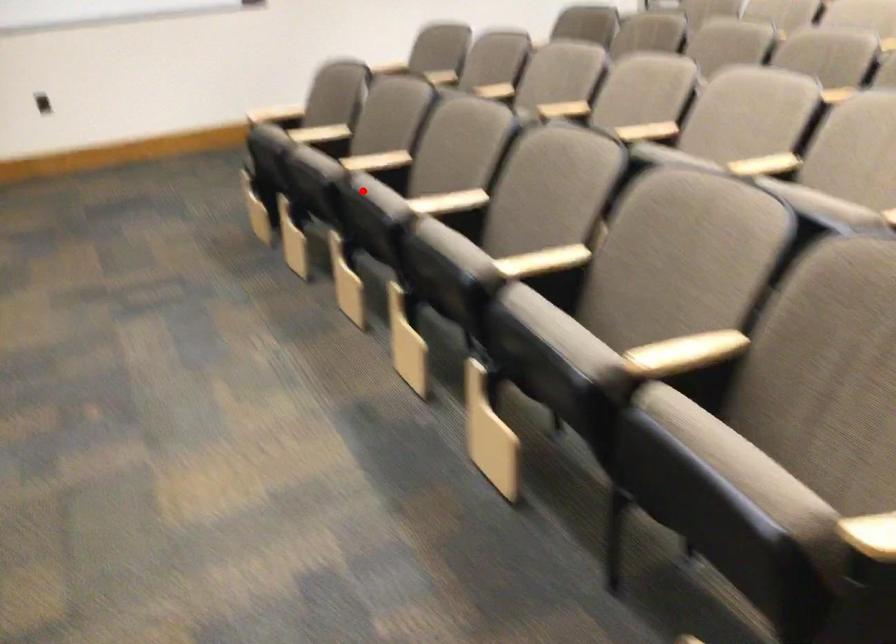
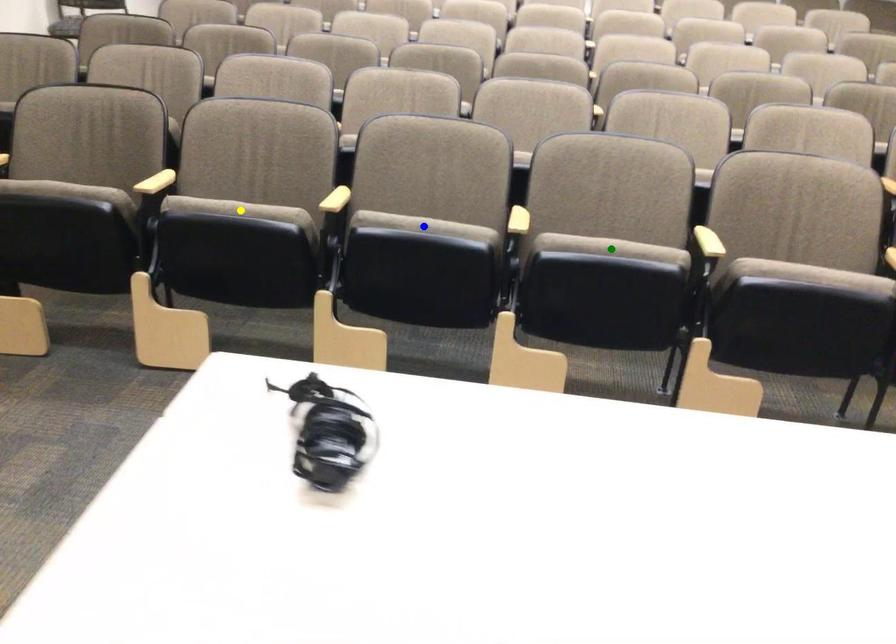
Question: I am providing you with two images of the same scene from different viewpoints. A red point is marked on the first image. You are given multiple points on the second image. Which mark in image 2 goes with the point in image 1?

Choices:
 (A) yellow point
 (B) green point
 (C) blue point

Answer: (C)